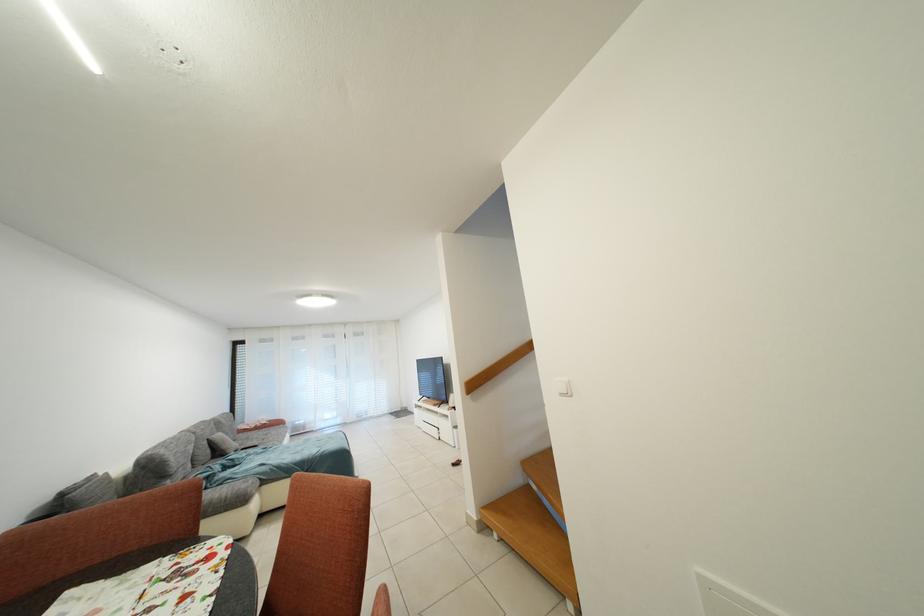
The image size is (924, 616). I want to click on orange chair sitting surface, so click(x=508, y=562).